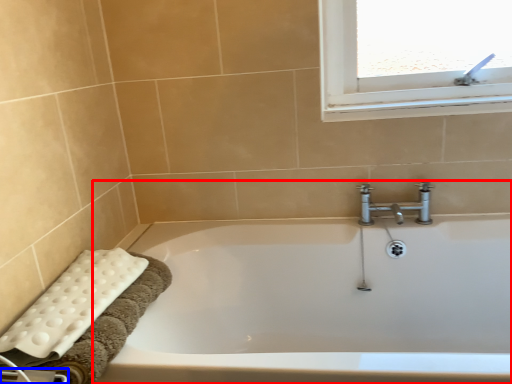
Question: Among these objects, which one is farthest to the camera, bathtub (highlighted by a red box) or towel bar (highlighted by a blue box)?

Choices:
 (A) bathtub
 (B) towel bar

Answer: (A)